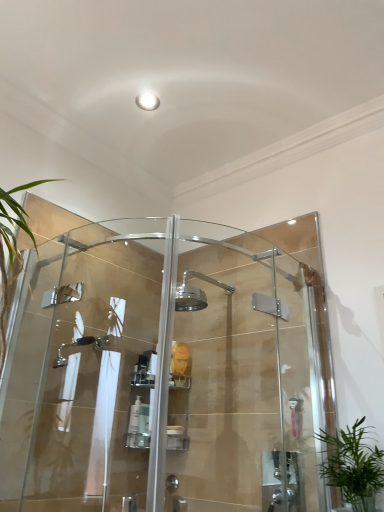
Question: Is white plastic soap dish at center, the third toiletry when ordered from left to right, positioned beyond the bounds of clear glass shower door at center, which ranks as the 1th screen door in left-to-right order?

Choices:
 (A) no
 (B) yes

Answer: (B)

Question: From a real-world perspective, is white plastic soap dish at center, which appears as the 1th toiletry when viewed from the right, beneath clear glass shower door at center, which is the 2th screen door from right to left?

Choices:
 (A) no
 (B) yes

Answer: (B)

Question: Does white plastic soap dish at center, the third toiletry when ordered from left to right, lie in front of clear glass shower door at center, which ranks as the 1th screen door in left-to-right order?

Choices:
 (A) no
 (B) yes

Answer: (A)

Question: From the image's perspective, is white plastic soap dish at center, the third toiletry when ordered from left to right, located beneath clear glass shower door at center, which ranks as the 1th screen door in left-to-right order?

Choices:
 (A) no
 (B) yes

Answer: (B)

Question: Is white plastic soap dish at center, which appears as the 1th toiletry when viewed from the right, not close to clear glass shower door at center, which is the 2th screen door from right to left?

Choices:
 (A) yes
 (B) no

Answer: (B)

Question: In terms of width, does white plastic pump bottle at center, marked as the first toiletry in a left-to-right arrangement, look wider or thinner when compared to clear plastic bottle at center, acting as the 2th toiletry starting from the right?

Choices:
 (A) thin
 (B) wide

Answer: (A)

Question: Is white plastic pump bottle at center, marked as the first toiletry in a left-to-right arrangement, inside the boundaries of clear plastic bottle at center, acting as the 2th toiletry starting from the right, or outside?

Choices:
 (A) outside
 (B) inside

Answer: (A)

Question: In the image, is white plastic pump bottle at center, marked as the first toiletry in a left-to-right arrangement, on the left side or the right side of clear plastic bottle at center, which is the 2th toiletry from left to right?

Choices:
 (A) left
 (B) right

Answer: (A)

Question: Is point (137, 401) positioned closer to the camera than point (144, 402)?

Choices:
 (A) closer
 (B) farther

Answer: (B)

Question: From a real-world perspective, is clear plastic bottle at center, which is the 2th toiletry from left to right, above or below white plastic pump bottle at center, marked as the first toiletry in a left-to-right arrangement?

Choices:
 (A) below
 (B) above

Answer: (A)

Question: Which is correct: clear plastic bottle at center, which is the 2th toiletry from left to right, is inside white plastic pump bottle at center, the 3th toiletry positioned from the right, or outside of it?

Choices:
 (A) inside
 (B) outside

Answer: (B)

Question: Visually, is clear plastic bottle at center, acting as the 2th toiletry starting from the right, positioned to the left or to the right of white plastic pump bottle at center, marked as the first toiletry in a left-to-right arrangement?

Choices:
 (A) right
 (B) left

Answer: (A)

Question: Is point (142, 406) positioned closer to the camera than point (127, 431)?

Choices:
 (A) farther
 (B) closer

Answer: (A)

Question: Based on their positions, is clear glass shower door at center, which is the 2th screen door from right to left, located to the left or right of white plastic soap dish at center, which appears as the 1th toiletry when viewed from the right?

Choices:
 (A) left
 (B) right

Answer: (A)

Question: Looking at their shapes, would you say clear glass shower door at center, which is the 2th screen door from right to left, is wider or thinner than white plastic soap dish at center, the third toiletry when ordered from left to right?

Choices:
 (A) wide
 (B) thin

Answer: (A)